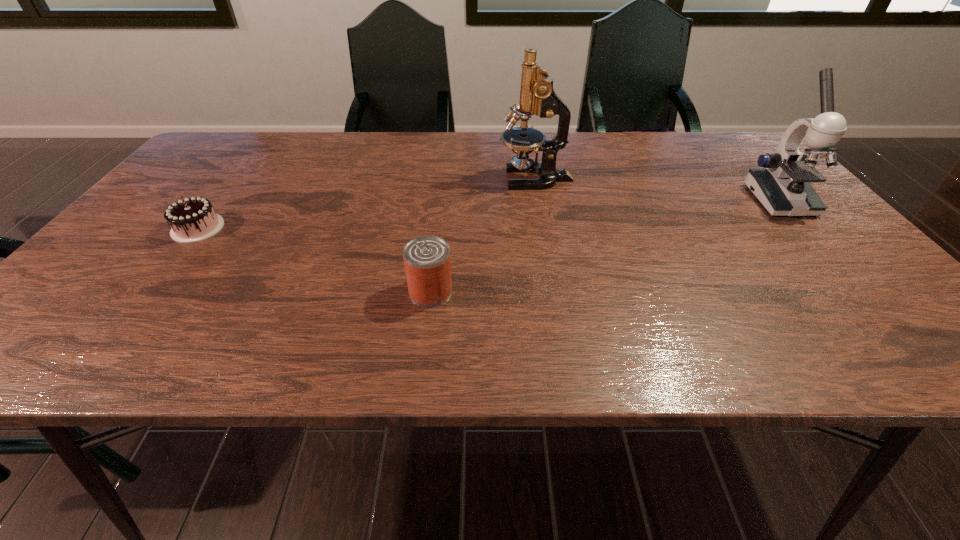
The width and height of the screenshot is (960, 540). In order to click on the left microscope in this screenshot , I will do `click(537, 96)`.

The image size is (960, 540). I want to click on the right microscope, so click(782, 186).

Where is `the nearest object`? This screenshot has width=960, height=540. the nearest object is located at coordinates (427, 263).

Where is `can`? can is located at coordinates (427, 263).

The width and height of the screenshot is (960, 540). Find the location of `chocolate cake`. chocolate cake is located at coordinates (194, 219).

Where is `the leftmost object`? the leftmost object is located at coordinates (194, 219).

Locate an element on the screen. free space located 0.370m at the eyepiece of the left microscope is located at coordinates (364, 179).

The height and width of the screenshot is (540, 960). I want to click on blank space located at the eyepiece of the left microscope, so click(422, 179).

Locate an element on the screen. This screenshot has width=960, height=540. free space located at the eyepiece of the left microscope is located at coordinates (462, 179).

Identify the location of free region located 0.230m on the front of the rightmost object. (853, 284).